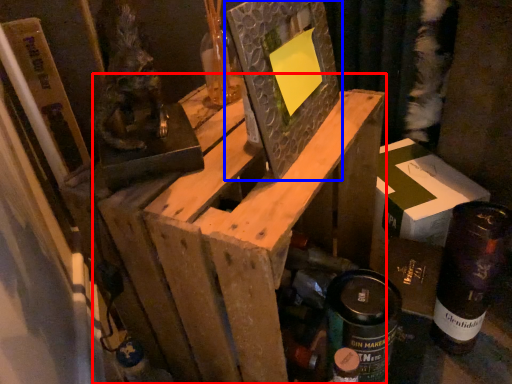
Question: Among these objects, which one is farthest to the camera, furniture (highlighted by a red box) or picture frame (highlighted by a blue box)?

Choices:
 (A) furniture
 (B) picture frame

Answer: (B)